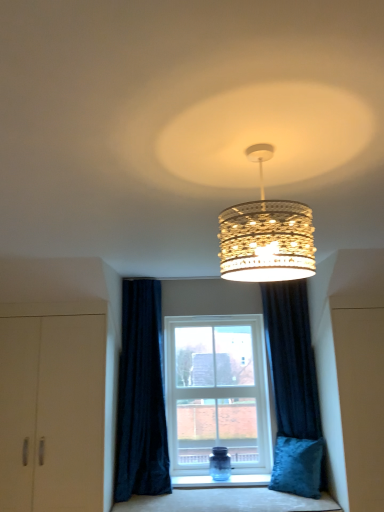
Question: Looking at the image, does velvet blue cushion at lower center seem bigger or smaller compared to velvet blue pillow at lower right?

Choices:
 (A) big
 (B) small

Answer: (A)

Question: Considering the positions of velvet blue cushion at lower center and velvet blue pillow at lower right in the image, is velvet blue cushion at lower center wider or thinner than velvet blue pillow at lower right?

Choices:
 (A) thin
 (B) wide

Answer: (B)

Question: Estimate the real-world distances between objects in this image. Which object is closer to the white plastic window at center?

Choices:
 (A) velvet blue pillow at lower right
 (B) velvet blue cushion at lower center
 (C) dark blue velvet curtain at lower center, the first curtain positioned from the left
 (D) velvet dark blue curtain at lower right, the first curtain in the right-to-left sequence
 (E) matte beige cabinet at left

Answer: (D)

Question: Estimate the real-world distances between objects in this image. Which object is farther from the white plastic window at center?

Choices:
 (A) gold textured chandelier at center
 (B) velvet blue pillow at lower right
 (C) velvet dark blue curtain at lower right, which ranks as the 2th curtain in left-to-right order
 (D) velvet blue cushion at lower center
 (E) matte beige cabinet at left

Answer: (A)